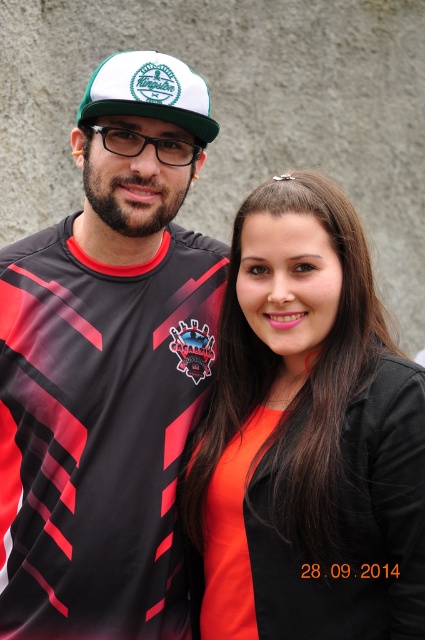
Does matte jersey at center have a greater width compared to orange matte shirt at center?

Yes.

At what (x,y) coordinates should I click in order to perform the action: click on matte jersey at center. Please return your answer as a coordinate pair (x, y). This screenshot has height=640, width=425. Looking at the image, I should click on (108, 369).

Identify the location of matte jersey at center. This screenshot has height=640, width=425. (108, 369).

Find the location of a particular element. The image size is (425, 640). matte jersey at center is located at coordinates (108, 369).

Is the position of orange matte shirt at center less distant than that of white matte baseball cap at upper center?

No, orange matte shirt at center is further to the viewer.

Which is above, orange matte shirt at center or white matte baseball cap at upper center?

white matte baseball cap at upper center is above.

Is point (342, 465) farther from viewer compared to point (155, 54)?

No, (342, 465) is in front of (155, 54).

Image resolution: width=425 pixels, height=640 pixels. What are the coordinates of `orange matte shirt at center` in the screenshot? It's located at pyautogui.click(x=308, y=440).

Which is above, matte jersey at center or white matte baseball cap at upper center?

white matte baseball cap at upper center

Can you confirm if matte jersey at center is positioned to the left of white matte baseball cap at upper center?

Indeed, matte jersey at center is positioned on the left side of white matte baseball cap at upper center.

Is point (96, 204) farther from camera compared to point (195, 136)?

That is True.

Find the location of a particular element. This screenshot has height=640, width=425. matte jersey at center is located at coordinates (108, 369).